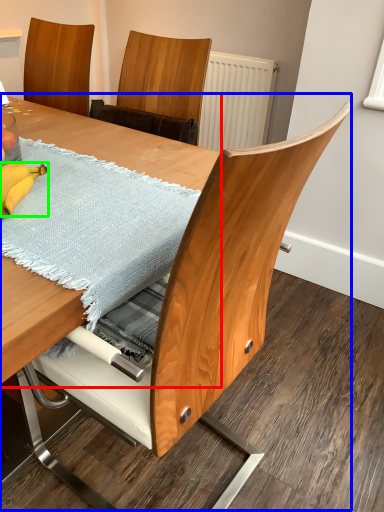
Question: Estimate the real-world distances between objects in this image. Which object is farther from table (highlighted by a red box), table (highlighted by a blue box) or banana (highlighted by a green box)?

Choices:
 (A) table
 (B) banana

Answer: (A)